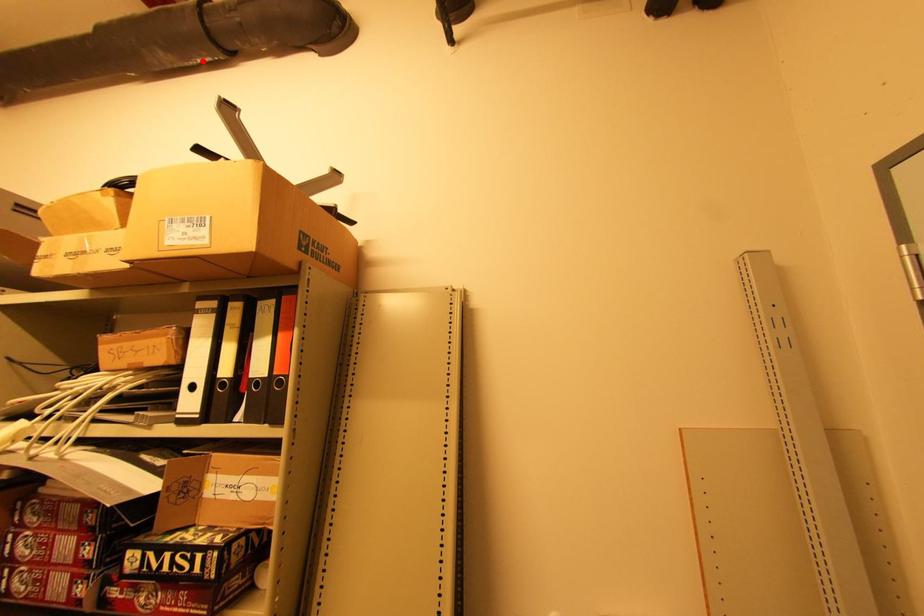
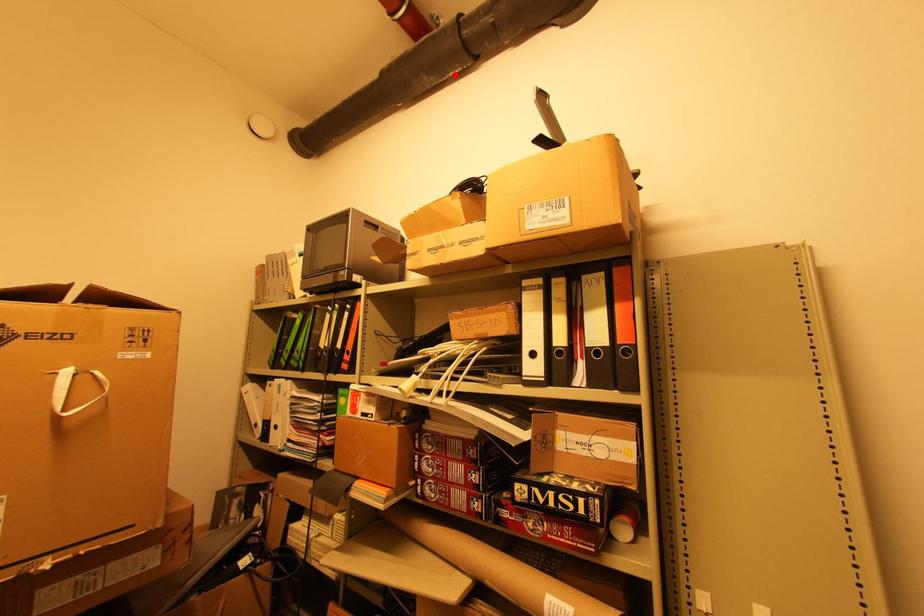
I am providing you with two images of the same scene from different viewpoints. A red point is marked on the first image and another point is marked on the second image. Is the red point in image1 aligned with the point shown in image2?

Yes